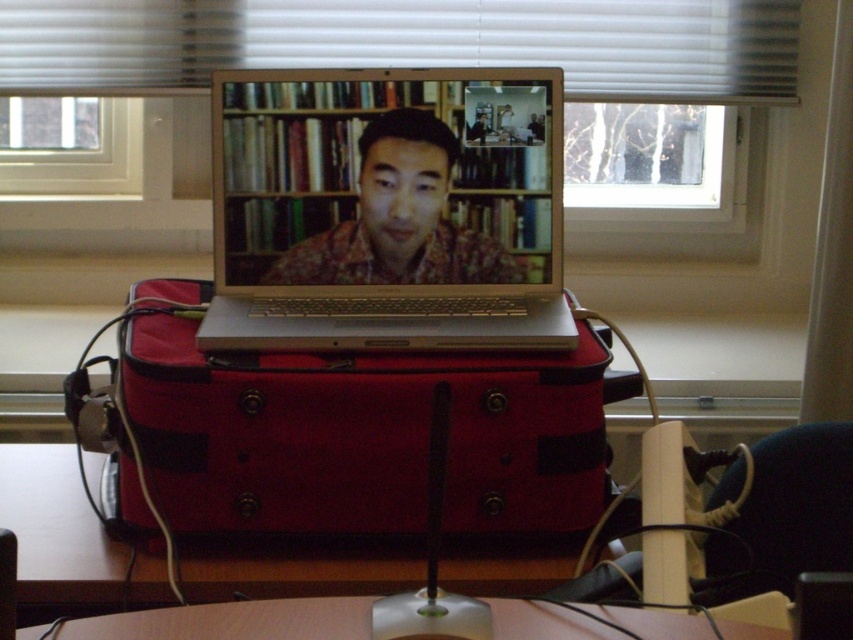
Question: Which of the following is the closest to the observer?

Choices:
 (A) wooden at center
 (B) white blinds at upper center

Answer: (A)

Question: Is white blinds at upper center to the right of transparent glass window at upper left from the viewer's perspective?

Choices:
 (A) no
 (B) yes

Answer: (B)

Question: Which object appears farthest from the camera in this image?

Choices:
 (A) transparent glass window at upper left
 (B) wooden at center
 (C) wooden table at center

Answer: (A)

Question: Can you confirm if matte brown shirt at center is smaller than transparent glass window at upper left?

Choices:
 (A) yes
 (B) no

Answer: (A)

Question: Is white blinds at upper center smaller than transparent glass window at upper left?

Choices:
 (A) yes
 (B) no

Answer: (B)

Question: Which of these objects is positioned farthest from the wooden at center?

Choices:
 (A) transparent glass window at upper left
 (B) white blinds at upper center
 (C) matte brown shirt at center
 (D) red fabric suitcase at center

Answer: (B)